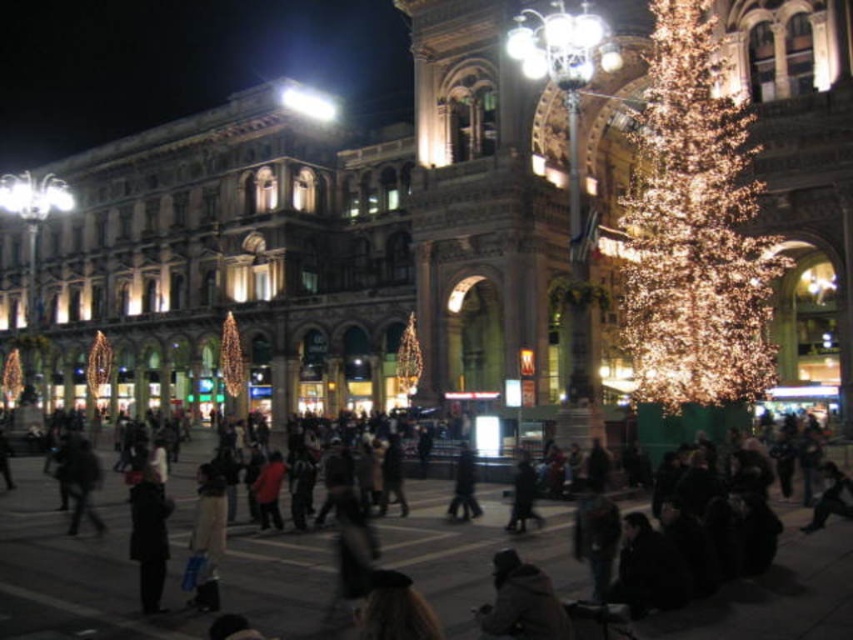
Is illuminated gold tree at right positioned at the back of dark gray coat at lower left?

Yes, it is behind dark gray coat at lower left.

Can you confirm if illuminated gold tree at right is positioned to the right of dark gray coat at lower left?

Correct, you'll find illuminated gold tree at right to the right of dark gray coat at lower left.

Which is in front, point (643, 278) or point (157, 564)?

Positioned in front is point (157, 564).

Image resolution: width=853 pixels, height=640 pixels. What are the coordinates of `illuminated gold tree at right` in the screenshot? It's located at (695, 228).

Which is below, dark gray coat at lower center or dark gray coat at lower left?

Positioned lower is dark gray coat at lower center.

Can you confirm if dark gray coat at lower center is taller than dark gray coat at lower left?

No.

Locate an element on the screen. This screenshot has height=640, width=853. dark gray coat at lower center is located at coordinates (521, 602).

Where is `dark gray coat at lower center`? Image resolution: width=853 pixels, height=640 pixels. dark gray coat at lower center is located at coordinates (521, 602).

Which is more to the left, dark clothing crowd at center or illuminated gold tree at right?

Positioned to the left is dark clothing crowd at center.

Can you confirm if dark clothing crowd at center is shorter than illuminated gold tree at right?

Indeed, dark clothing crowd at center has a lesser height compared to illuminated gold tree at right.

Is point (225, 579) positioned before point (688, 371)?

Yes, point (225, 579) is closer to viewer.

At what (x,y) coordinates should I click in order to perform the action: click on dark clothing crowd at center. Please return your answer as a coordinate pair (x, y). Looking at the image, I should click on (84, 566).